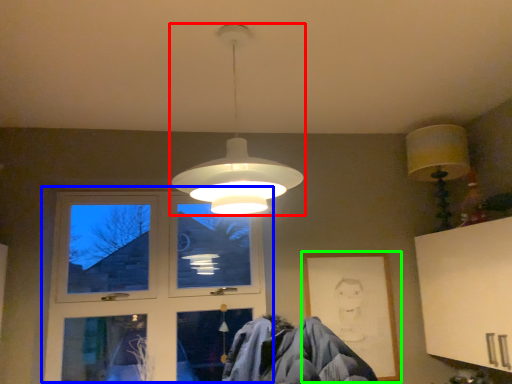
Question: Which object is the farthest from lamp (highlighted by a red box)? Choose among these: window (highlighted by a blue box) or picture frame (highlighted by a green box).

Choices:
 (A) window
 (B) picture frame

Answer: (A)